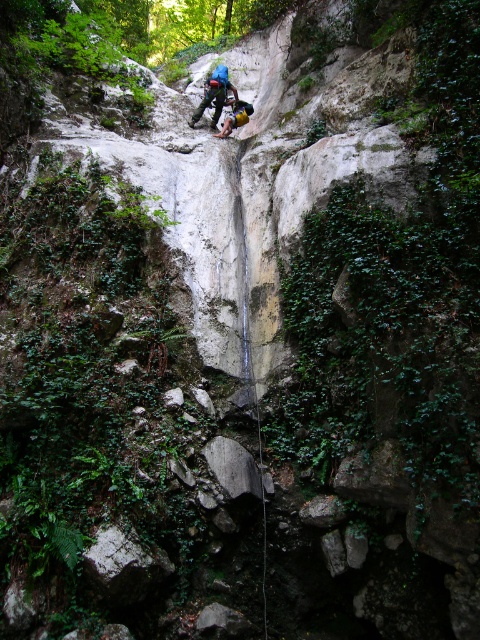
Can you confirm if blue fabric backpack at center is smaller than blue fabric helmet at upper center?

Actually, blue fabric backpack at center might be larger than blue fabric helmet at upper center.

The image size is (480, 640). In order to click on blue fabric backpack at center in this screenshot , I will do `click(214, 93)`.

Locate an element on the screen. Image resolution: width=480 pixels, height=640 pixels. blue fabric backpack at center is located at coordinates click(x=214, y=93).